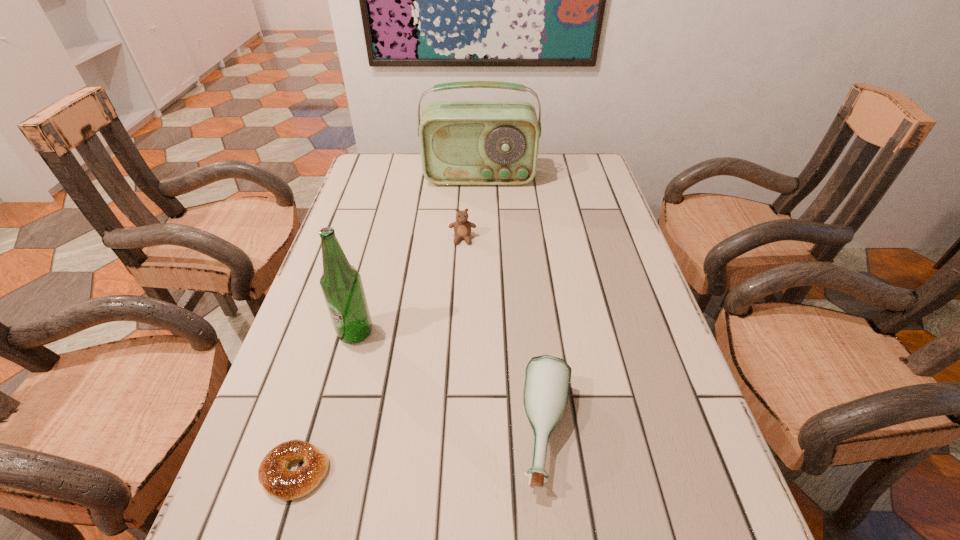
I want to click on radio receiver, so click(462, 142).

Image resolution: width=960 pixels, height=540 pixels. I want to click on the third farthest object, so tap(341, 284).

You are a GUI agent. You are given a task and a screenshot of the screen. Output one action in this format:
    pyautogui.click(x=<x>, y=<y>)
    Task: Click on the second farthest object
    The height and width of the screenshot is (540, 960).
    Given the screenshot: What is the action you would take?
    pyautogui.click(x=462, y=227)

Locate an element on the screen. This screenshot has height=540, width=960. bottle is located at coordinates (547, 379).

Locate an element on the screen. the shortest object is located at coordinates (273, 474).

Identify the location of free space located 0.150m on the front panel of the radio receiver. tap(479, 216).

You are a GUI agent. You are given a task and a screenshot of the screen. Output one action in this format:
    pyautogui.click(x=<x>, y=<y>)
    Task: Click on the vacant space located on the label of the third nearest object
    The image size is (960, 540).
    Given the screenshot: What is the action you would take?
    pyautogui.click(x=324, y=452)

You are a GUI agent. You are given a task and a screenshot of the screen. Output one action in this format:
    pyautogui.click(x=<x>, y=<y>)
    Task: Click on the free space located 0.350m on the front-facing side of the second farthest object
    Image resolution: width=960 pixels, height=540 pixels.
    Given the screenshot: What is the action you would take?
    pyautogui.click(x=458, y=350)

The height and width of the screenshot is (540, 960). Identify the location of vacant space situated on the back of the bottle. coord(537,343).

Identify the location of vacant area situated 0.160m on the right of the shortest object. (423, 472).